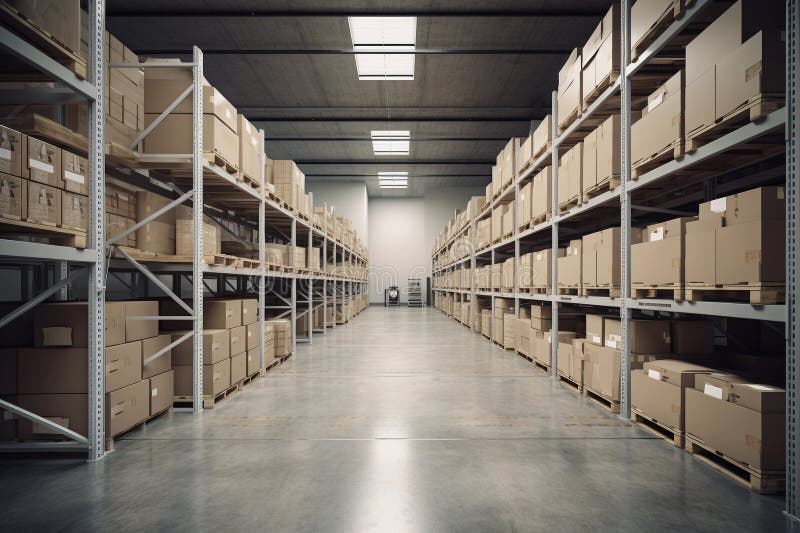
Find the location of a particular element. The image size is (800, 533). ceiling lights is located at coordinates (390, 64), (397, 141), (394, 175), (394, 183).